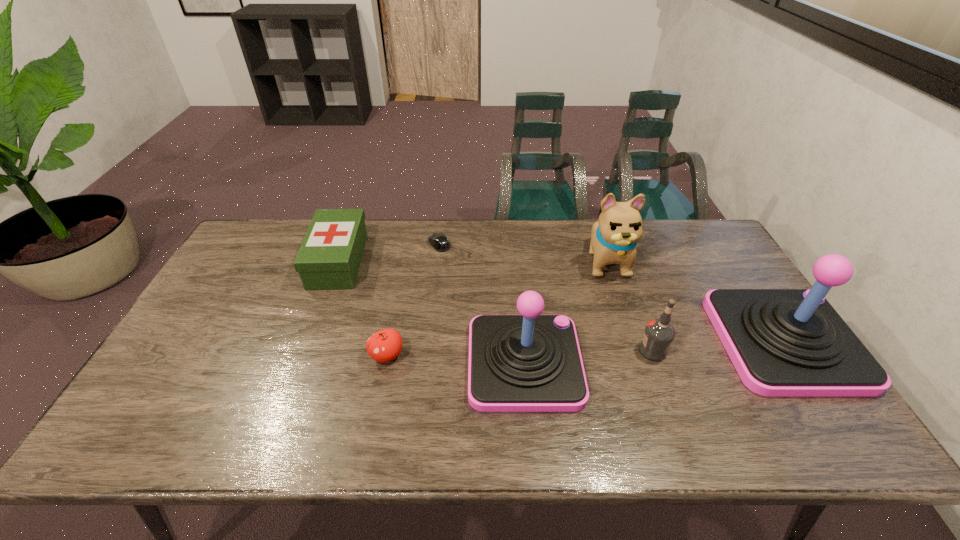
The image size is (960, 540). What are the coordinates of `free spot between the taller joystick and the third shortest object` in the screenshot? It's located at (562, 301).

Where is `empty space that is in between the right joystick and the mouse`? The image size is (960, 540). empty space that is in between the right joystick and the mouse is located at coordinates (612, 293).

Locate an element on the screen. The width and height of the screenshot is (960, 540). object that can be found as the sixth closest to the fourth object from left to right is located at coordinates (782, 342).

The height and width of the screenshot is (540, 960). I want to click on object identified as the closest to the first-aid kit, so [x=439, y=241].

Where is `free region that satisfies the following two spatial constraints: 1. forward from the base of the taller joystick; 2. on the front side of the apple`? The height and width of the screenshot is (540, 960). free region that satisfies the following two spatial constraints: 1. forward from the base of the taller joystick; 2. on the front side of the apple is located at coordinates (794, 356).